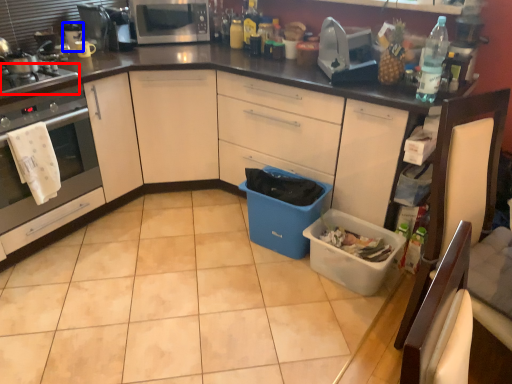
Question: Which object appears farthest to the camera in this image, gas stove (highlighted by a red box) or appliance (highlighted by a blue box)?

Choices:
 (A) gas stove
 (B) appliance

Answer: (B)